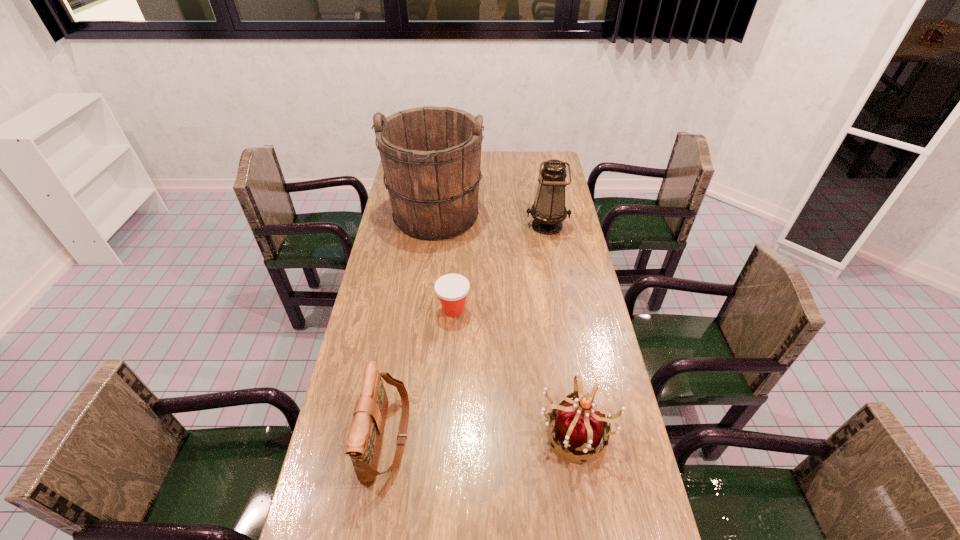
Identify the location of vacant space positioned on the right of the shortest object. (526, 310).

I want to click on bucket present at the left edge, so click(431, 156).

Where is `shoulder bag that is at the left edge`? shoulder bag that is at the left edge is located at coordinates (365, 436).

The height and width of the screenshot is (540, 960). In order to click on oil lamp that is at the right edge in this screenshot , I will do `click(548, 211)`.

This screenshot has width=960, height=540. Find the location of `tiara present at the right edge`. tiara present at the right edge is located at coordinates (579, 425).

The width and height of the screenshot is (960, 540). Identify the location of vacant area at the far edge. (518, 165).

Where is `vacant area at the left edge of the desktop`? vacant area at the left edge of the desktop is located at coordinates (377, 335).

This screenshot has width=960, height=540. I want to click on blank space at the right edge, so click(x=564, y=283).

Identify the location of vacant area at the far right corner of the desktop. Image resolution: width=960 pixels, height=540 pixels. (533, 162).

The width and height of the screenshot is (960, 540). I want to click on vacant space that's between the tallest object and the shortest object, so click(x=444, y=264).